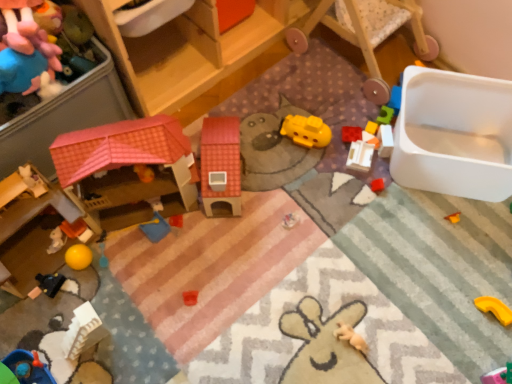
This screenshot has height=384, width=512. What are the coordinates of `vacant area that lies between white plastic blocks at right, which is the second toy in right-to-left order, and light brown plush toy at lower right, which appears as the 6th toy when viewed from the left` in the screenshot? It's located at (364, 247).